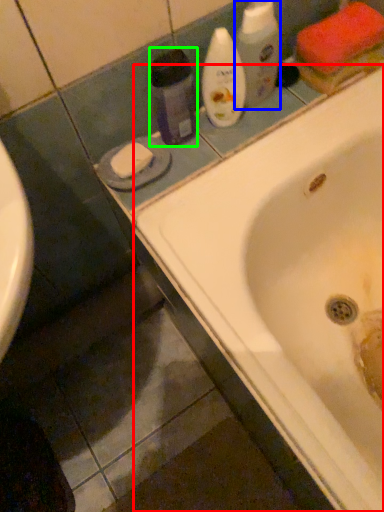
Question: Estimate the real-world distances between objects in this image. Which object is closer to bathtub (highlighted by a red box), cleaning product (highlighted by a blue box) or cleaning product (highlighted by a green box)?

Choices:
 (A) cleaning product
 (B) cleaning product

Answer: (B)